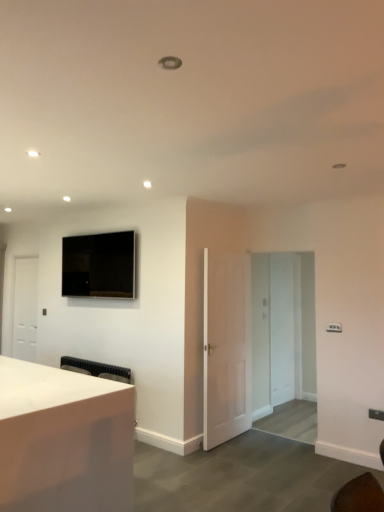
Question: Would you say transparent glass door at center is outside white glossy desk at lower left?

Choices:
 (A) no
 (B) yes

Answer: (B)

Question: Can you confirm if transparent glass door at center is positioned to the left of white glossy desk at lower left?

Choices:
 (A) yes
 (B) no

Answer: (B)

Question: Could you tell me if transparent glass door at center is facing white glossy desk at lower left?

Choices:
 (A) yes
 (B) no

Answer: (B)

Question: From a real-world perspective, is transparent glass door at center positioned over white glossy desk at lower left based on gravity?

Choices:
 (A) no
 (B) yes

Answer: (B)

Question: Is transparent glass door at center bigger than white glossy desk at lower left?

Choices:
 (A) yes
 (B) no

Answer: (B)

Question: Is white matte door at left, which appears as the 2th door when viewed from the right, to the left or to the right of white glossy desk at lower left in the image?

Choices:
 (A) right
 (B) left

Answer: (B)

Question: Looking at their shapes, would you say white matte door at left, the first door when ordered from back to front, is wider or thinner than white glossy desk at lower left?

Choices:
 (A) wide
 (B) thin

Answer: (B)

Question: From a real-world perspective, is white matte door at left, the first door when ordered from back to front, physically located above or below white glossy desk at lower left?

Choices:
 (A) above
 (B) below

Answer: (A)

Question: Considering the positions of point (x=13, y=352) and point (x=21, y=457), is point (x=13, y=352) closer or farther from the camera than point (x=21, y=457)?

Choices:
 (A) closer
 (B) farther

Answer: (B)

Question: Considering the positions of matte black tv at upper left and transparent glass door at center in the image, is matte black tv at upper left taller or shorter than transparent glass door at center?

Choices:
 (A) tall
 (B) short

Answer: (B)

Question: Is matte black tv at upper left in front of or behind transparent glass door at center in the image?

Choices:
 (A) behind
 (B) front

Answer: (B)

Question: Would you say matte black tv at upper left is inside or outside transparent glass door at center?

Choices:
 (A) outside
 (B) inside

Answer: (A)

Question: Based on their positions, is matte black tv at upper left located to the left or right of transparent glass door at center?

Choices:
 (A) left
 (B) right

Answer: (A)

Question: Considering the positions of white matte door at center, which appears as the 1th door when viewed from the right, and white matte door at left, the 2th door from the front, in the image, is white matte door at center, which appears as the 1th door when viewed from the right, wider or thinner than white matte door at left, the 2th door from the front,?

Choices:
 (A) thin
 (B) wide

Answer: (A)

Question: Is white matte door at center, which appears as the 1th door when viewed from the right, inside the boundaries of white matte door at left, the first door when ordered from back to front, or outside?

Choices:
 (A) inside
 (B) outside

Answer: (B)